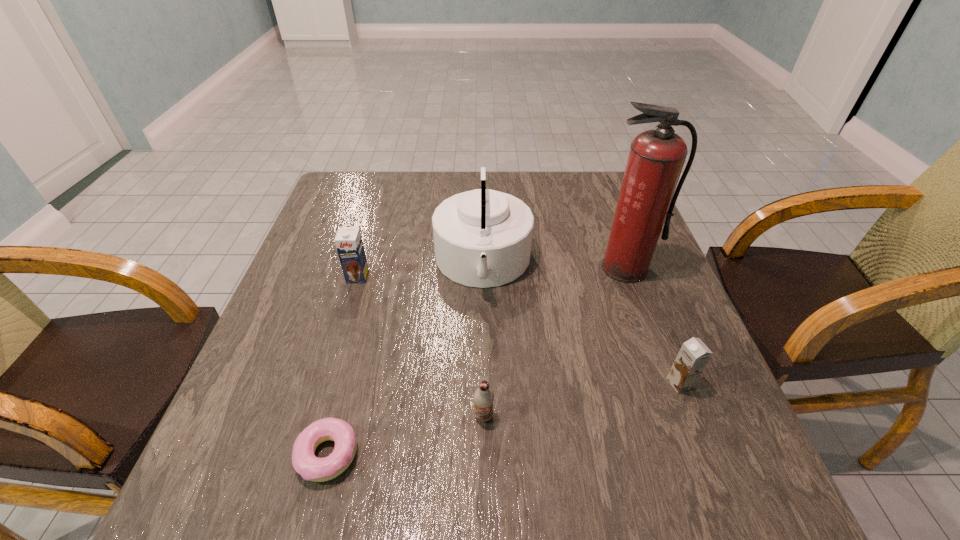
This screenshot has height=540, width=960. Identify the location of the tallest object. (646, 200).

This screenshot has width=960, height=540. What are the coordinates of `the second tallest object` in the screenshot? It's located at (482, 238).

You are a GUI agent. You are given a task and a screenshot of the screen. Output one action in this format:
    pyautogui.click(x=<x>, y=<y>)
    Task: Click on the farthest chocolate milk
    The width and height of the screenshot is (960, 540).
    Given the screenshot: What is the action you would take?
    pyautogui.click(x=348, y=241)

This screenshot has width=960, height=540. What are the coordinates of `the leftmost chocolate milk` in the screenshot? It's located at (348, 241).

Identify the location of the fourth farthest object. click(x=694, y=355).

Identify the location of the rightmost chocolate milk. Image resolution: width=960 pixels, height=540 pixels. (694, 355).

At what (x,y) coordinates should I click in order to perform the action: click on the second nearest object. Please return your answer as a coordinate pair (x, y). Looking at the image, I should click on (483, 397).

The height and width of the screenshot is (540, 960). I want to click on the nearest chocolate milk, so click(483, 397).

In order to click on the nearest object in this screenshot , I will do `click(305, 463)`.

Where is `the shortest object`? This screenshot has width=960, height=540. the shortest object is located at coordinates (305, 463).